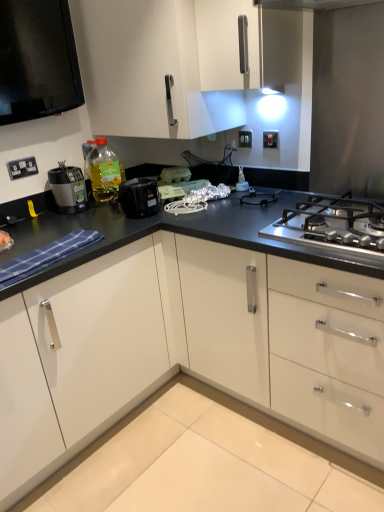
Question: Are white plastic electrical outlet at upper left, marked as the 3th electric outlet in a back-to-front arrangement, and stainless steel gas stove at right making contact?

Choices:
 (A) no
 (B) yes

Answer: (A)

Question: Is stainless steel gas stove at right located within white plastic electrical outlet at upper left, which appears as the 1th electric outlet when viewed from the front?

Choices:
 (A) no
 (B) yes

Answer: (A)

Question: Is white plastic electrical outlet at upper left, the 3th electric outlet positioned from the top, smaller than stainless steel gas stove at right?

Choices:
 (A) yes
 (B) no

Answer: (A)

Question: Does white plastic electrical outlet at upper left, which appears as the 1th electric outlet when viewed from the front, have a lesser height compared to stainless steel gas stove at right?

Choices:
 (A) no
 (B) yes

Answer: (B)

Question: From the image's perspective, is white plastic electrical outlet at upper left, which appears as the 1th electric outlet when viewed from the front, located above stainless steel gas stove at right?

Choices:
 (A) no
 (B) yes

Answer: (B)

Question: Looking at the image, does matte black food processor at left seem bigger or smaller compared to stainless steel gas stove at right?

Choices:
 (A) small
 (B) big

Answer: (A)

Question: Based on their positions, is matte black food processor at left located to the left or right of stainless steel gas stove at right?

Choices:
 (A) right
 (B) left

Answer: (B)

Question: Is matte black food processor at left inside or outside of stainless steel gas stove at right?

Choices:
 (A) outside
 (B) inside

Answer: (A)

Question: Relative to stainless steel gas stove at right, is matte black food processor at left in front or behind?

Choices:
 (A) behind
 (B) front

Answer: (A)

Question: Which is correct: translucent yellow bottle at upper left is inside white plastic switch at upper right, placed as the 3th electric outlet when sorted from left to right, or outside of it?

Choices:
 (A) inside
 (B) outside

Answer: (B)

Question: Is translucent yellow bottle at upper left wider or thinner than white plastic switch at upper right, which appears as the second electric outlet when viewed from the front?

Choices:
 (A) wide
 (B) thin

Answer: (A)

Question: Is point (109, 198) positioned closer to the camera than point (268, 144)?

Choices:
 (A) closer
 (B) farther

Answer: (B)

Question: From a real-world perspective, is translucent yellow bottle at upper left physically located above or below white plastic switch at upper right, which appears as the second electric outlet when viewed from the front?

Choices:
 (A) above
 (B) below

Answer: (B)

Question: Relative to white glossy cabinet at upper center, is white plastic electric outlet at upper center, the second electric outlet from the right, in front or behind?

Choices:
 (A) front
 (B) behind

Answer: (B)

Question: From a real-world perspective, is white plastic electric outlet at upper center, which is counted as the first electric outlet, starting from the back, positioned above or below white glossy cabinet at upper center?

Choices:
 (A) below
 (B) above

Answer: (A)